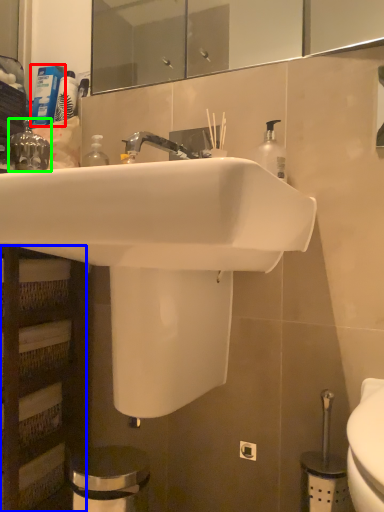
Question: Considering the real-world distances, which object is farthest from toiletry (highlighted by a red box)? shelf (highlighted by a blue box) or plumbing fixture (highlighted by a green box)?

Choices:
 (A) shelf
 (B) plumbing fixture

Answer: (A)